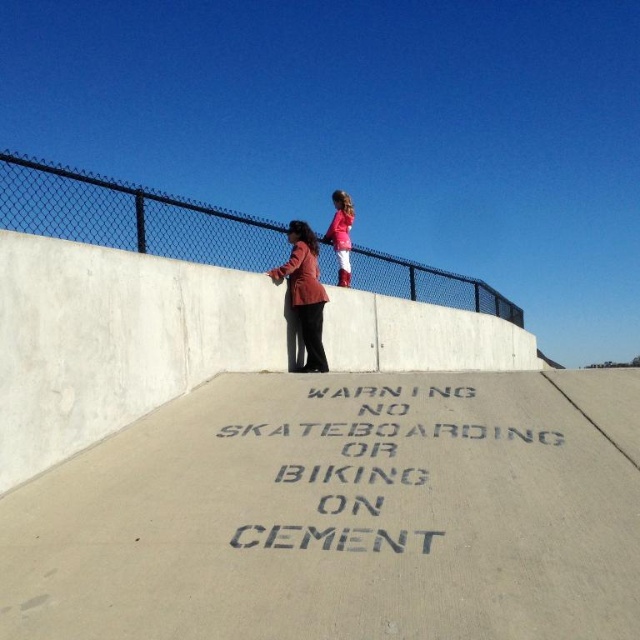
Between black chain-link fence at upper center and black painted warning sign at center, which one has less height?

With less height is black painted warning sign at center.

From the picture: Who is more forward, (412, 273) or (262, 534)?

Point (262, 534)

Measure the distance between point (99, 221) and camera.

Point (99, 221) and camera are 4.79 meters apart.

Locate an element on the screen. black chain-link fence at upper center is located at coordinates (131, 216).

Does black chain-link fence at upper center appear on the right side of matte pink jacket at upper center?

Indeed, black chain-link fence at upper center is positioned on the right side of matte pink jacket at upper center.

Is black chain-link fence at upper center positioned before matte pink jacket at upper center?

That is True.

Does point (419, 273) come behind point (349, 244)?

Yes, it is behind point (349, 244).

Image resolution: width=640 pixels, height=640 pixels. In order to click on black chain-link fence at upper center in this screenshot , I will do `click(131, 216)`.

Locate an element on the screen. The image size is (640, 640). black painted warning sign at center is located at coordinates (378, 438).

Is point (422, 550) positioned before point (301, 321)?

Yes.

Identify the location of black painted warning sign at center. The height and width of the screenshot is (640, 640). (378, 438).